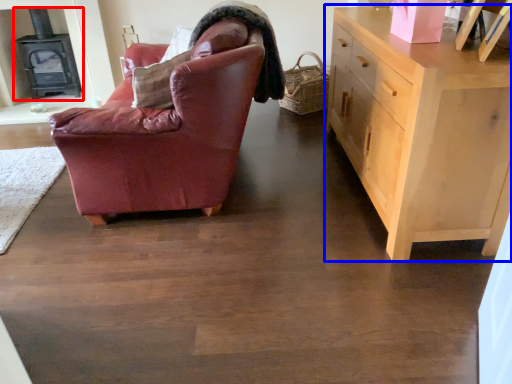
Question: Which object is further to the camera taking this photo, fireplace (highlighted by a red box) or chest of drawers (highlighted by a blue box)?

Choices:
 (A) fireplace
 (B) chest of drawers

Answer: (A)